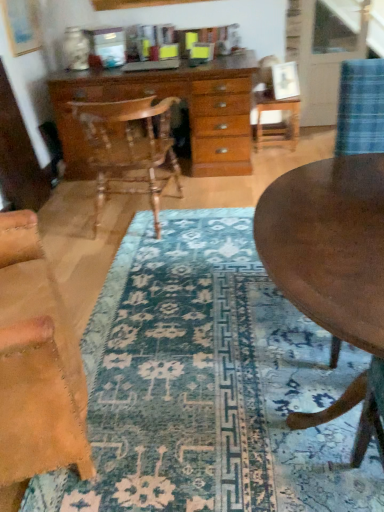
In order to click on free space above blue patterned rug at center (from a real-world perspective) in this screenshot , I will do `click(177, 301)`.